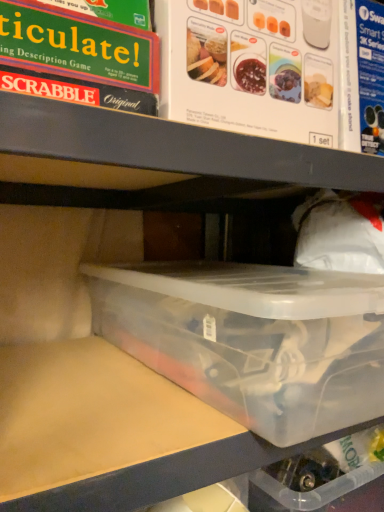
Consider the image. What is the approximate height of clear plastic container at center?

The height of clear plastic container at center is 17.37 inches.

This screenshot has width=384, height=512. Describe the element at coordinates (174, 146) in the screenshot. I see `clear plastic container at center` at that location.

Measure the distance between point (212,141) and camera.

Point (212,141) is 48.10 centimeters away from camera.

Where is `clear plastic container at center`? The width and height of the screenshot is (384, 512). clear plastic container at center is located at coordinates (174, 146).

Describe the element at coordinates (253, 339) in the screenshot. I see `transparent plastic container at center` at that location.

The height and width of the screenshot is (512, 384). I want to click on transparent plastic container at center, so click(253, 339).

I want to click on clear plastic container at center, so click(174, 146).

Is clear plastic container at center to the right of transparent plastic container at center from the viewer's perspective?

No.

Relative to transparent plastic container at center, is clear plastic container at center in front or behind?

Visually, clear plastic container at center is located behind transparent plastic container at center.

Which point is more distant from viewer, (349, 189) or (298, 441)?

Point (349, 189)

From the image's perspective, between clear plastic container at center and transparent plastic container at center, who is located below?

transparent plastic container at center is shown below in the image.

From a real-world perspective, which is physically below, clear plastic container at center or transparent plastic container at center?

From a 3D spatial view, transparent plastic container at center is below.

Looking at this image, considering the sizes of clear plastic container at center and transparent plastic container at center in the image, is clear plastic container at center wider or thinner than transparent plastic container at center?

Clearly, clear plastic container at center has less width compared to transparent plastic container at center.

Can you confirm if clear plastic container at center is shorter than transparent plastic container at center?

No, clear plastic container at center is not shorter than transparent plastic container at center.

Can you confirm if clear plastic container at center is bigger than transparent plastic container at center?

Yes.

Is clear plastic container at center inside the boundaries of transparent plastic container at center, or outside?

clear plastic container at center is not inside transparent plastic container at center, it's outside.

Is there a large distance between clear plastic container at center and transparent plastic container at center?

Actually, clear plastic container at center and transparent plastic container at center are a little close together.

Is transparent plastic container at center at the back of clear plastic container at center?

That's not correct — clear plastic container at center is not looking away from transparent plastic container at center.

Identify the location of box below the clear plastic container at center (from the image's perspective). (253, 339).

Which is more to the right, transparent plastic container at center or clear plastic container at center?

Positioned to the right is transparent plastic container at center.

Does transparent plastic container at center lie behind clear plastic container at center?

No, it is in front of clear plastic container at center.

Consider the image. Which is less distant, (x=320, y=374) or (x=127, y=116)?

Point (x=320, y=374) is farther from the camera than point (x=127, y=116).

From the image's perspective, between transparent plastic container at center and clear plastic container at center, who is located below?

transparent plastic container at center is shown below in the image.

In the scene shown: From a real-world perspective, does transparent plastic container at center stand above clear plastic container at center?

No, from a real-world perspective, transparent plastic container at center is not above clear plastic container at center.

Looking at their sizes, would you say transparent plastic container at center is wider or thinner than clear plastic container at center?

A: Considering their sizes, transparent plastic container at center looks broader than clear plastic container at center.

Considering the relative sizes of transparent plastic container at center and clear plastic container at center in the image provided, is transparent plastic container at center taller than clear plastic container at center?

No, transparent plastic container at center is not taller than clear plastic container at center.

Looking at this image, who is bigger, transparent plastic container at center or clear plastic container at center?

Bigger between the two is clear plastic container at center.

Is transparent plastic container at center positioned beyond the bounds of clear plastic container at center?

Yes, transparent plastic container at center is outside of clear plastic container at center.

Is transparent plastic container at center beside clear plastic container at center?

transparent plastic container at center and clear plastic container at center are not in contact.

Is transparent plastic container at center facing towards clear plastic container at center?

No, transparent plastic container at center is not turned towards clear plastic container at center.

How much distance is there between transparent plastic container at center and clear plastic container at center?

transparent plastic container at center is 10.43 inches away from clear plastic container at center.

Find the location of a particular element. The width and height of the screenshot is (384, 512). box in front of the clear plastic container at center is located at coordinates (253, 339).

The height and width of the screenshot is (512, 384). Identify the location of shelf behind the transparent plastic container at center. pyautogui.click(x=174, y=146).

Locate an element on the screen. This screenshot has height=512, width=384. box below the clear plastic container at center (from a real-world perspective) is located at coordinates (253, 339).